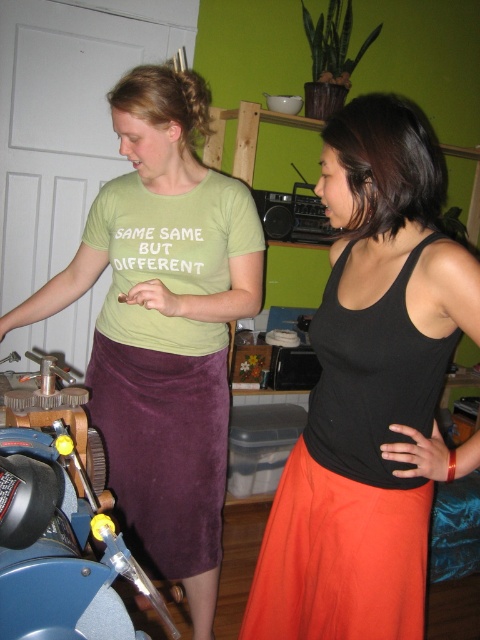
Consider the image. Does black matte tank top at center appear on the left side of velvet purple skirt at center?

Incorrect, black matte tank top at center is not on the left side of velvet purple skirt at center.

Can you confirm if black matte tank top at center is positioned to the right of velvet purple skirt at center?

Correct, you'll find black matte tank top at center to the right of velvet purple skirt at center.

At what (x,y) coordinates should I click in order to perform the action: click on black matte tank top at center. Please return your answer as a coordinate pair (x, y). This screenshot has width=480, height=640. Looking at the image, I should click on (x=370, y=394).

How far apart are black matte tank top at center and brushed metal motorcycle at lower left?

18.96 inches

Find the location of `black matte tank top at center`. black matte tank top at center is located at coordinates [x=370, y=394].

Locate an element on the screen. black matte tank top at center is located at coordinates (370, 394).

The width and height of the screenshot is (480, 640). In order to click on black matte tank top at center in this screenshot , I will do `click(370, 394)`.

Can you confirm if velvet purple skirt at center is wider than brushed metal motorcycle at lower left?

Yes, velvet purple skirt at center is wider than brushed metal motorcycle at lower left.

Who is more forward, (211, 477) or (0, 620)?

Point (0, 620) is in front.

Find the location of a particular element. velvet purple skirt at center is located at coordinates (164, 324).